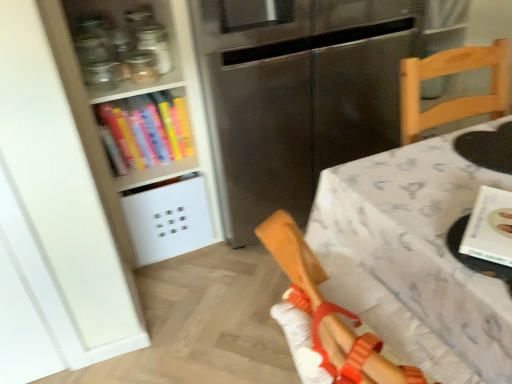
Question: Is white textured tablecloth at center shorter than stainless steel fridge at center?

Choices:
 (A) no
 (B) yes

Answer: (B)

Question: Is the position of white textured tablecloth at center more distant than that of stainless steel fridge at center?

Choices:
 (A) yes
 (B) no

Answer: (B)

Question: From a real-world perspective, is white textured tablecloth at center physically below stainless steel fridge at center?

Choices:
 (A) yes
 (B) no

Answer: (A)

Question: Is there a large distance between white textured tablecloth at center and stainless steel fridge at center?

Choices:
 (A) no
 (B) yes

Answer: (A)

Question: Considering the relative sizes of white textured tablecloth at center and stainless steel fridge at center in the image provided, is white textured tablecloth at center smaller than stainless steel fridge at center?

Choices:
 (A) yes
 (B) no

Answer: (A)

Question: Are white textured tablecloth at center and stainless steel fridge at center beside each other?

Choices:
 (A) no
 (B) yes

Answer: (A)

Question: Are white paper book at right, positioned as the 1th book in front-to-back order, and white textured tablecloth at center located far from each other?

Choices:
 (A) no
 (B) yes

Answer: (A)

Question: From a real-world perspective, is white paper book at right, positioned as the second book in back-to-front order, below white textured tablecloth at center?

Choices:
 (A) yes
 (B) no

Answer: (B)

Question: Is white textured tablecloth at center surrounded by white paper book at right, placed as the 2th book when sorted from top to bottom?

Choices:
 (A) no
 (B) yes

Answer: (A)

Question: Does white paper book at right, which ranks as the 1th book in bottom-to-top order, come in front of white textured tablecloth at center?

Choices:
 (A) yes
 (B) no

Answer: (B)

Question: Considering the relative sizes of white paper book at right, the 2th book in the left-to-right sequence, and white textured tablecloth at center in the image provided, is white paper book at right, the 2th book in the left-to-right sequence, thinner than white textured tablecloth at center?

Choices:
 (A) no
 (B) yes

Answer: (B)

Question: Does white paper book at right, the 2th book in the left-to-right sequence, have a larger size compared to white textured tablecloth at center?

Choices:
 (A) yes
 (B) no

Answer: (B)

Question: Is stainless steel fridge at center behind wooden chair at right?

Choices:
 (A) no
 (B) yes

Answer: (B)